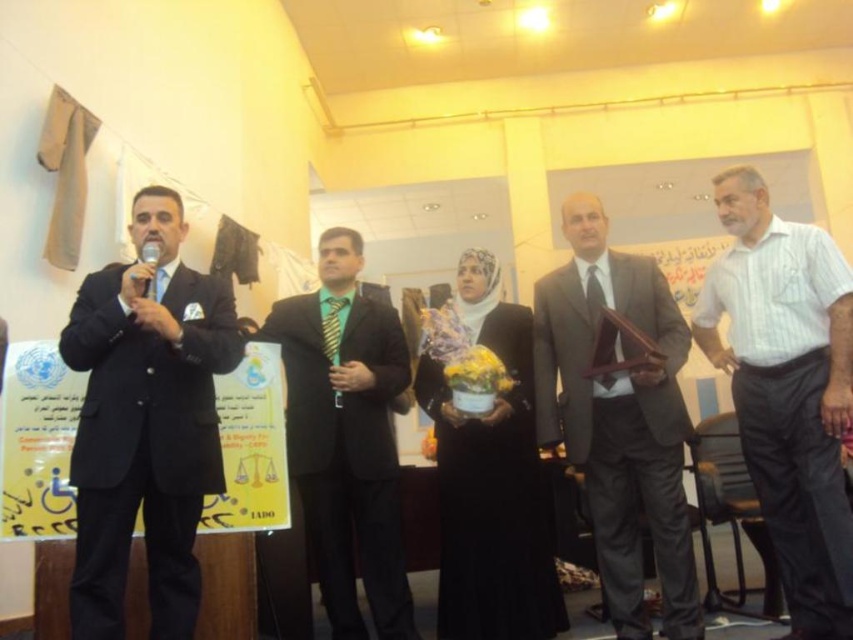
Question: Is black suit at left wider than green silk suit at center?

Choices:
 (A) no
 (B) yes

Answer: (A)

Question: Is white striped shirt at center above matte brown tie at center?

Choices:
 (A) no
 (B) yes

Answer: (A)

Question: Does black suit at left have a lesser width compared to matte gray suit at center?

Choices:
 (A) no
 (B) yes

Answer: (B)

Question: Estimate the real-world distances between objects in this image. Which object is closer to the black suit at left?

Choices:
 (A) green silk suit at center
 (B) matte brown tie at center
 (C) white striped shirt at center

Answer: (A)

Question: Which of the following is the closest to the observer?

Choices:
 (A) (608, 468)
 (B) (149, 596)
 (C) (602, 372)
 (D) (152, 291)

Answer: (B)

Question: Which of the following is the farthest from the observer?

Choices:
 (A) (360, 424)
 (B) (598, 352)

Answer: (A)